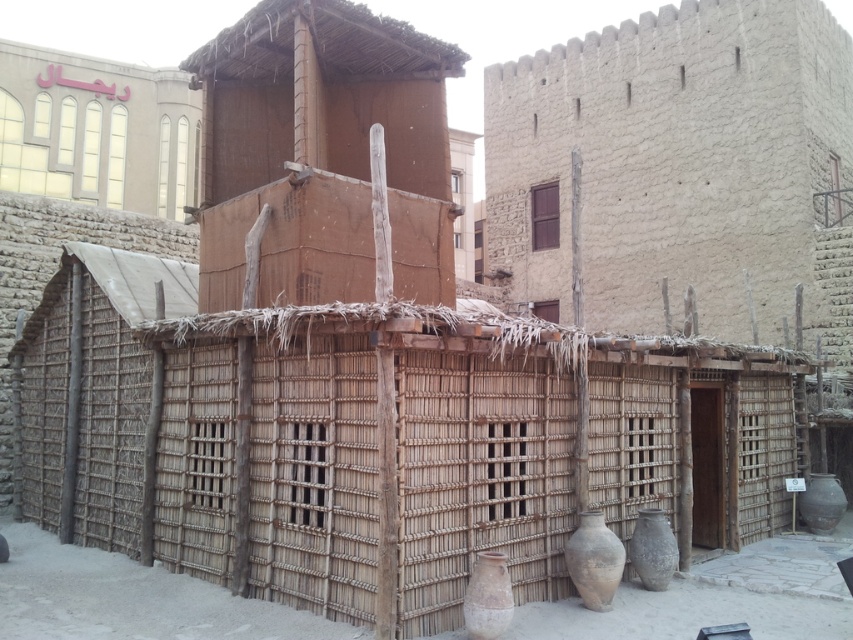
You are an archaeologist examining the scene. You need to determine which vase is closer to you. Based on the arrangement of the earthy clay vase at center and the brown earthenware vase at lower right, which one is positioned closer to your viewpoint?

The earthy clay vase at center is positioned closer to your viewpoint because it is in front of the brown earthenware vase at lower right.

You are a visitor standing in front of the brown mud hut at center and the earthy brown clay vase at lower right. Which object is taller?

The earthy brown clay vase at lower right is taller than the brown mud hut at center.